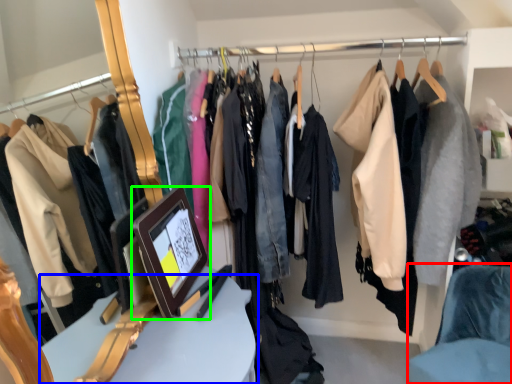
Question: Based on their relative distances, which object is nearer to chair (highlighted by a red box)? Choose from furniture (highlighted by a blue box) and picture frame (highlighted by a green box).

Choices:
 (A) furniture
 (B) picture frame

Answer: (A)